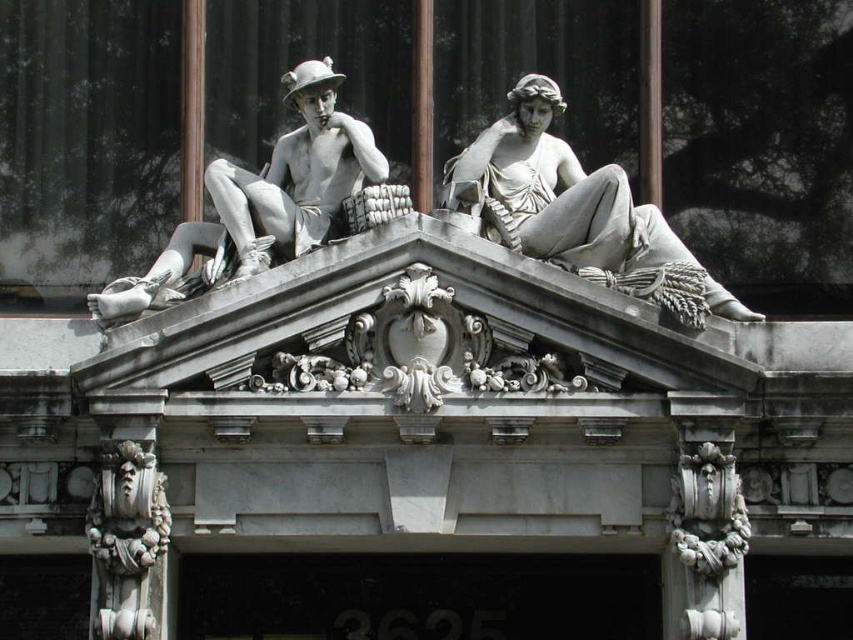
Question: Which point appears closest to the camera in this image?

Choices:
 (A) (132, 561)
 (B) (653, 253)
 (C) (358, 140)

Answer: (A)

Question: Does white marble statue at upper right have a greater width compared to white stone decorative element at lower left?

Choices:
 (A) yes
 (B) no

Answer: (A)

Question: Which point is closer to the camera taking this photo?

Choices:
 (A) (90, 296)
 (B) (129, 516)
 (C) (558, 156)

Answer: (B)

Question: Does white marble statue at upper right appear under white stone decorative element at lower left?

Choices:
 (A) yes
 (B) no

Answer: (B)

Question: Is white marble statue at upper right positioned in front of matte stone statue at upper left?

Choices:
 (A) no
 (B) yes

Answer: (B)

Question: Estimate the real-world distances between objects in this image. Which object is farther from the white stone decorative element at lower left?

Choices:
 (A) matte stone statue at upper left
 (B) white marble statue at upper right

Answer: (B)